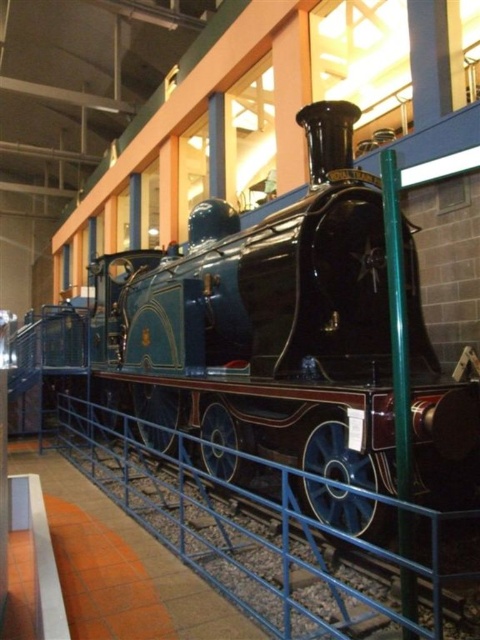
Does glossy black train at center appear on the right side of blue metal rail at lower center?

Yes, glossy black train at center is to the right of blue metal rail at lower center.

What do you see at coordinates (262, 323) in the screenshot? I see `glossy black train at center` at bounding box center [262, 323].

Identify the location of glossy black train at center. The width and height of the screenshot is (480, 640). (262, 323).